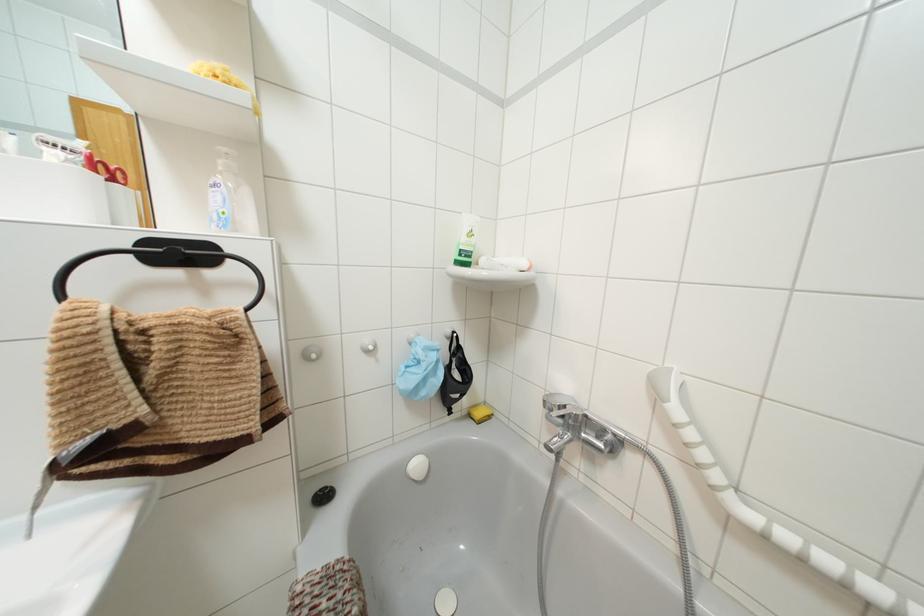
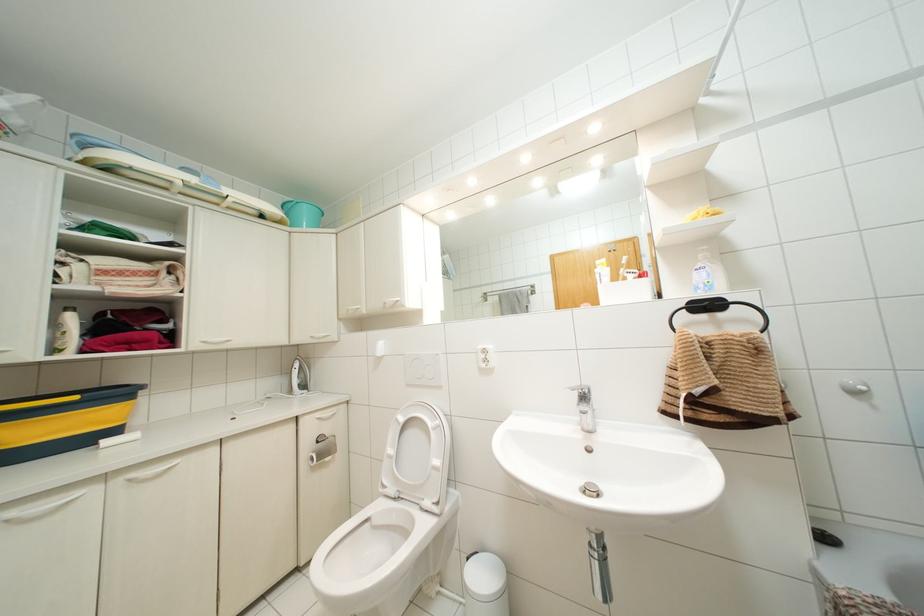
Where in the second image is the point corresponding to (215,66) from the first image?

(701, 208)